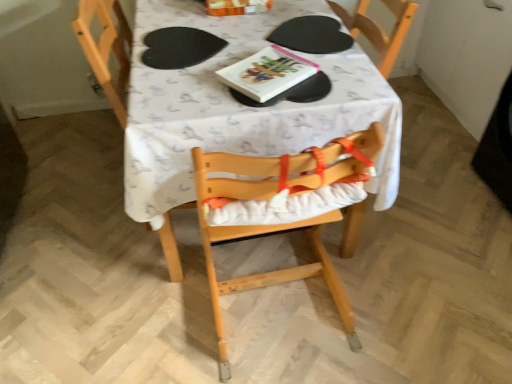
Image resolution: width=512 pixels, height=384 pixels. I want to click on empty space that is in between white fabric table at center and natural wood highchair at center, so click(x=274, y=311).